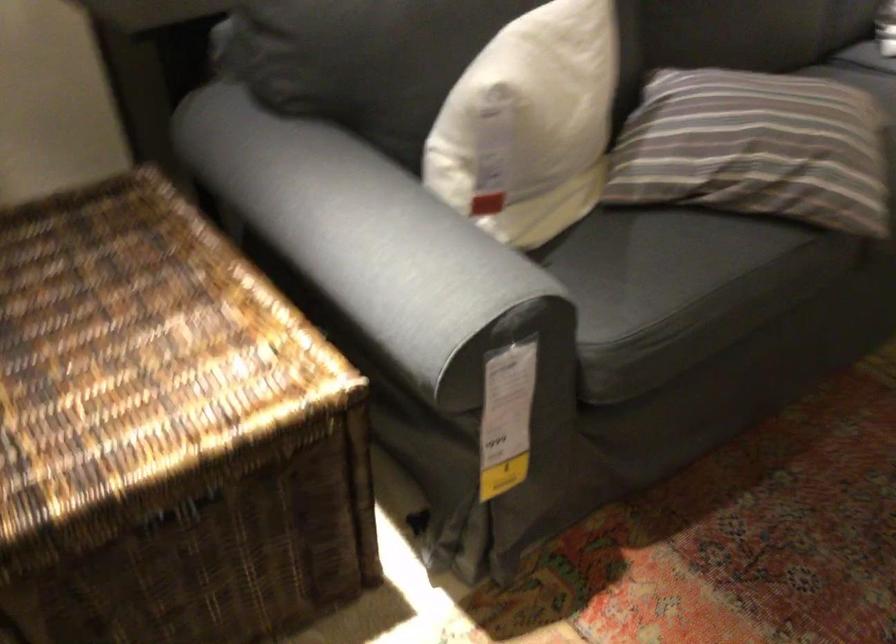
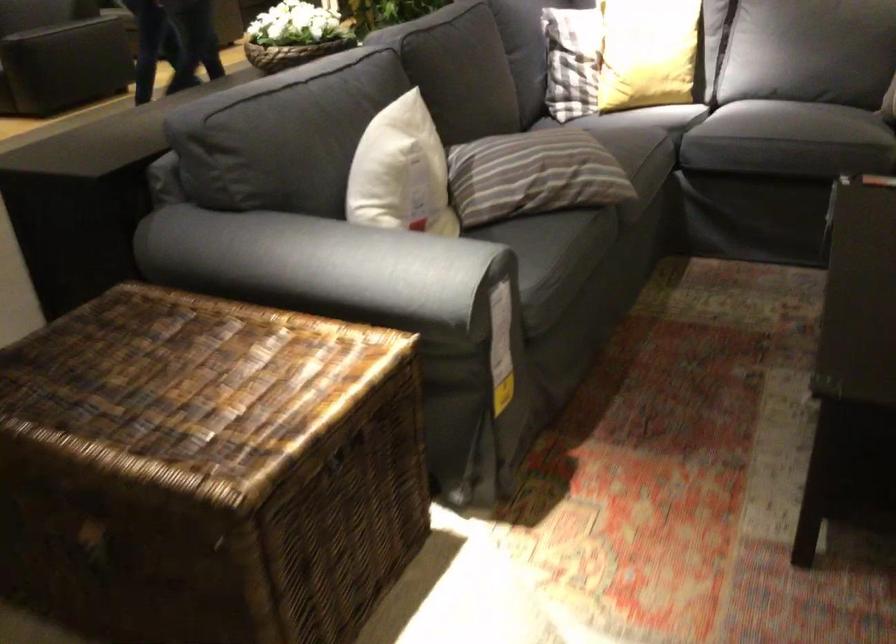
Locate, in the second image, the point that corresponds to point 298,216 in the first image.

(304, 265)